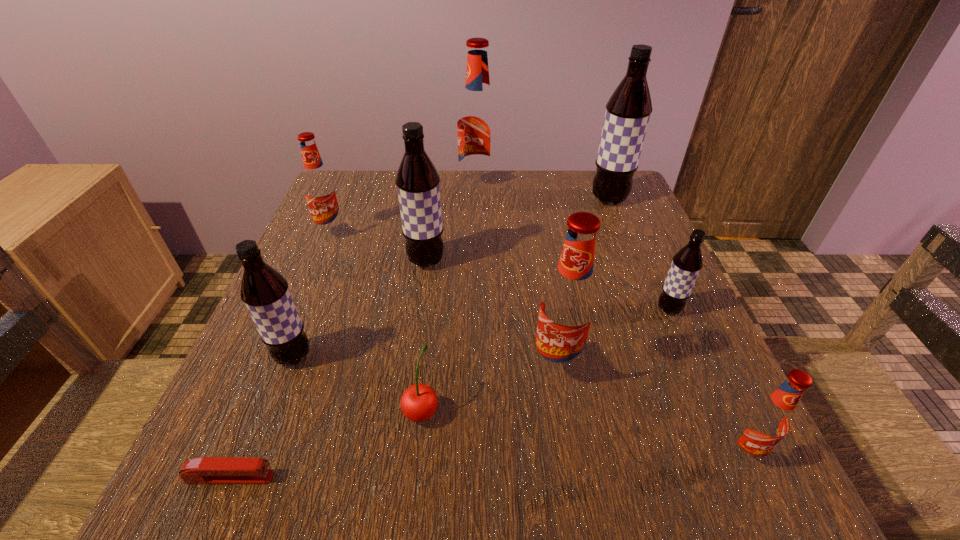
This screenshot has width=960, height=540. In order to click on object that stands as the sixth closest to the farthest red root beer in this screenshot , I will do `click(265, 292)`.

Image resolution: width=960 pixels, height=540 pixels. I want to click on root beer identified as the closest to the sixth nearest object, so click(x=568, y=307).

Choose which root beer is the sixth nearest neighbor to the red cherry. Please provide its 2D coordinates. Your answer should be formatted as a tuple, i.e. [(x, y)], where the tuple contains the x and y coordinates of a point satisfying the conditions above.

[(320, 191)]

Identify the location of red root beer that stands as the third closest to the red stapler. (766, 422).

You are a GUI agent. You are given a task and a screenshot of the screen. Output one action in this format:
    pyautogui.click(x=<x>, y=<y>)
    Task: Click on the red root beer object that ranks as the fourth closest to the leftmost brown root beer
    
    Given the screenshot: What is the action you would take?
    pyautogui.click(x=766, y=422)

Where is `the third closest brown root beer to the second shortest object`? the third closest brown root beer to the second shortest object is located at coordinates (687, 263).

You are a GUI agent. You are given a task and a screenshot of the screen. Output one action in this format:
    pyautogui.click(x=<x>, y=<y>)
    Task: Click on the brown root beer that is the third closest to the leftmost brown root beer
    
    Given the screenshot: What is the action you would take?
    pyautogui.click(x=628, y=110)

The height and width of the screenshot is (540, 960). In order to click on free location that satisfies the following two spatial constraints: 1. on the front side of the third nearest red root beer; 2. on the left side of the leftmost brown root beer in this screenshot , I will do `click(280, 356)`.

This screenshot has height=540, width=960. In order to click on free space that satisfies the following two spatial constraints: 1. on the front side of the rightmost red root beer; 2. on the front-facing side of the shortest object in this screenshot , I will do `click(755, 477)`.